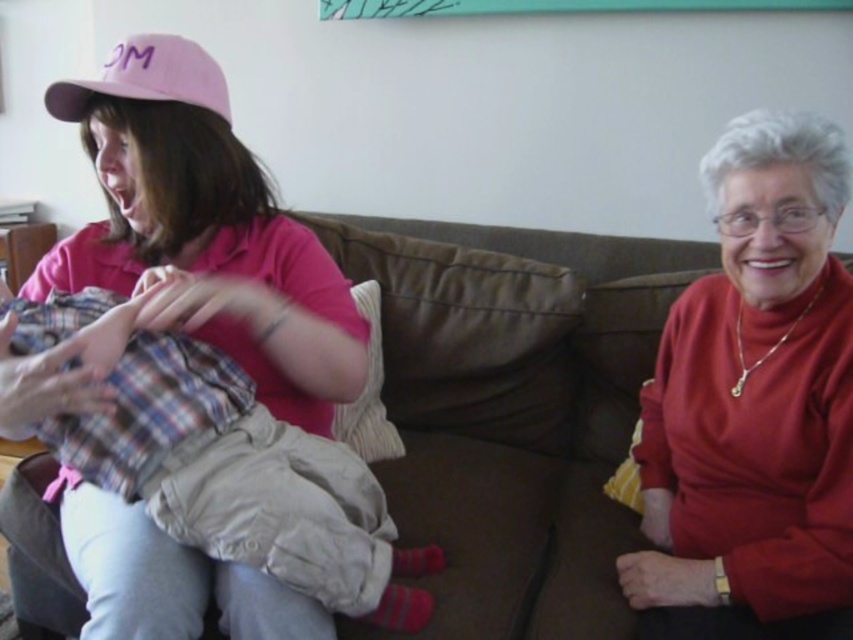
Question: Can you confirm if brown fabric couch at center is positioned to the right of plaid fabric baby at center?

Choices:
 (A) no
 (B) yes

Answer: (B)

Question: Is brown fabric couch at center further to the viewer compared to plaid fabric baby at center?

Choices:
 (A) yes
 (B) no

Answer: (A)

Question: Which object is closer to the camera taking this photo?

Choices:
 (A) brown fabric couch at center
 (B) matte red sweater at right
 (C) pink fabric cap at upper left
 (D) plaid fabric baby at center

Answer: (D)

Question: Is matte red sweater at right to the right of plaid fabric baby at center from the viewer's perspective?

Choices:
 (A) yes
 (B) no

Answer: (A)

Question: Which of the following is the farthest from the observer?

Choices:
 (A) plaid fabric baby at center
 (B) matte red sweater at right
 (C) pink fabric cap at upper left

Answer: (C)

Question: Which point is farther from the camera taking this photo?

Choices:
 (A) (18, 566)
 (B) (138, 480)
 (C) (790, 625)
 (D) (172, 44)

Answer: (A)